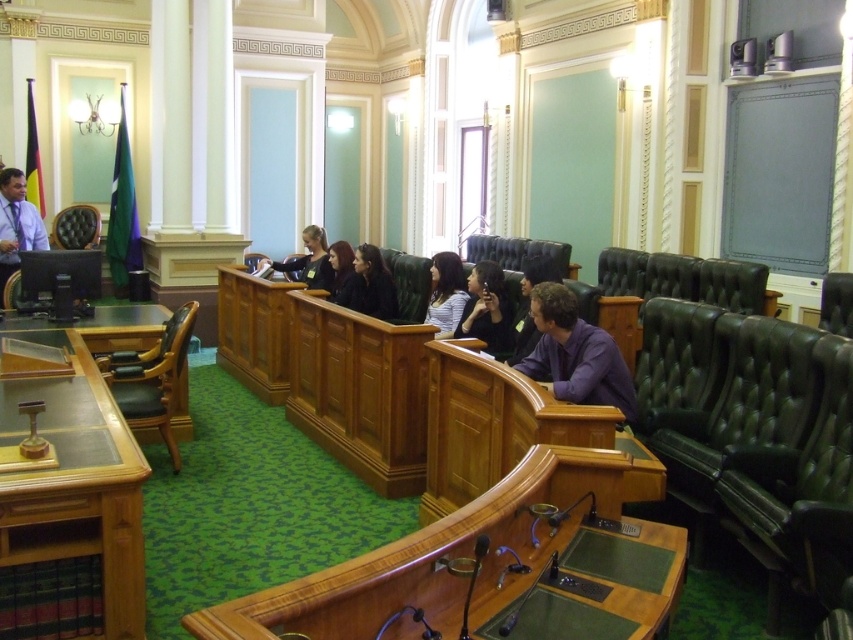
Is matte black jacket at center above leather tufted chair at left?

Incorrect, matte black jacket at center is not positioned above leather tufted chair at left.

Does matte black jacket at center appear under leather tufted chair at left?

Indeed, matte black jacket at center is positioned under leather tufted chair at left.

Is point (480, 326) farther from viewer compared to point (84, 237)?

That is False.

I want to click on matte black jacket at center, so click(486, 308).

Which is more to the left, white striped shirt at center or matte black laptop at center?

Positioned to the left is matte black laptop at center.

Which is in front, point (460, 307) or point (328, 276)?

Point (460, 307) is in front.

Locate an element on the screen. Image resolution: width=853 pixels, height=640 pixels. white striped shirt at center is located at coordinates (445, 292).

This screenshot has height=640, width=853. What are the coordinates of `white striped shirt at center` in the screenshot? It's located at (445, 292).

Who is taller, matte black jacket at center or white striped shirt at center?

matte black jacket at center is taller.

Is point (474, 312) closer to viewer compared to point (445, 252)?

Yes.

Image resolution: width=853 pixels, height=640 pixels. In order to click on matte black jacket at center in this screenshot , I will do `click(486, 308)`.